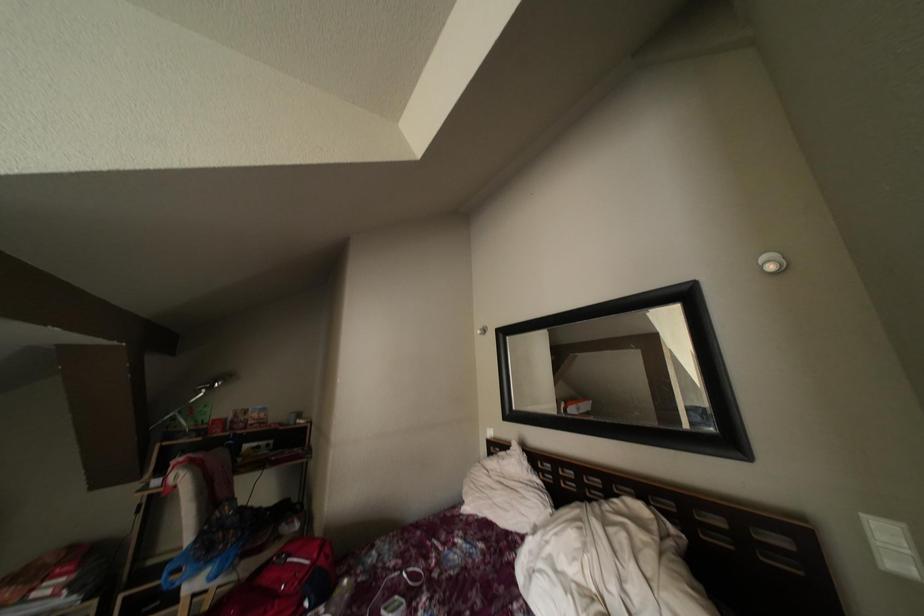
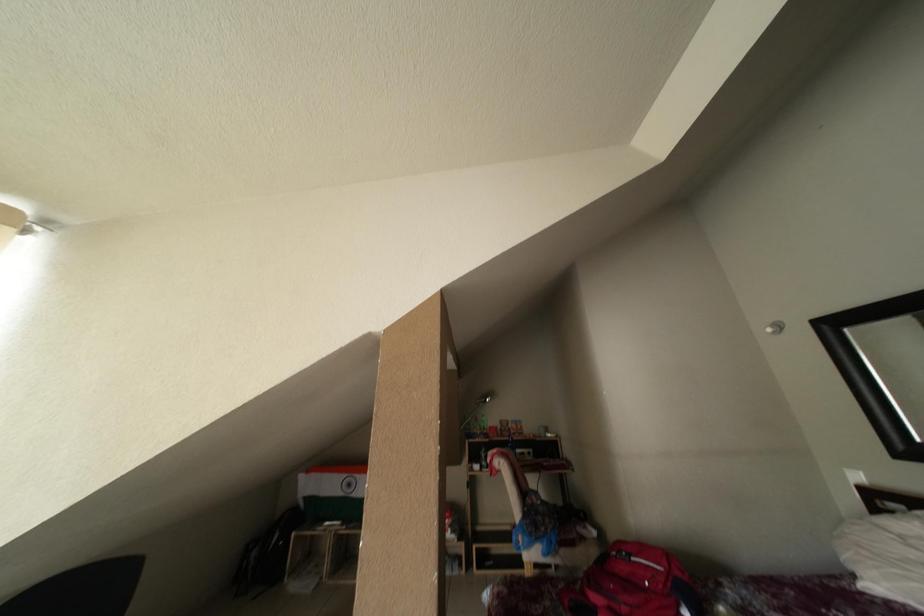
Question: The first image is from the beginning of the video and the second image is from the end. How did the camera likely rotate when shooting the video?

Choices:
 (A) Left
 (B) Right
 (C) Up
 (D) Down

Answer: (A)